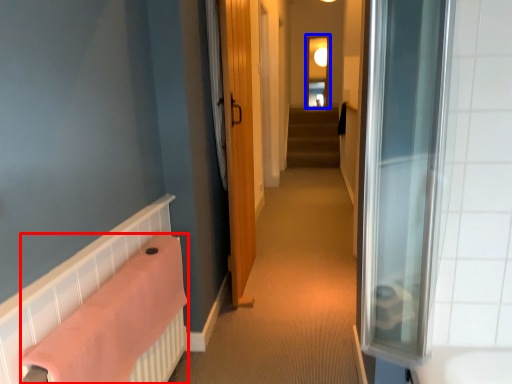
Question: Which of the following is the closest to the observer, bath towel (highlighted by a red box) or window (highlighted by a blue box)?

Choices:
 (A) bath towel
 (B) window

Answer: (A)